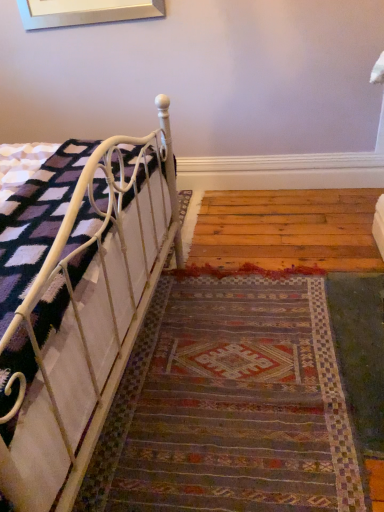
Question: From a real-world perspective, is white metal bed at left positioned above or below multicolored woven rug at center?

Choices:
 (A) below
 (B) above

Answer: (B)

Question: Is white metal bed at left to the left or to the right of multicolored woven rug at center in the image?

Choices:
 (A) left
 (B) right

Answer: (A)

Question: Is white metal bed at left wider or thinner than multicolored woven rug at center?

Choices:
 (A) thin
 (B) wide

Answer: (A)

Question: Considering the positions of multicolored woven rug at center and white metal bed at left in the image, is multicolored woven rug at center wider or thinner than white metal bed at left?

Choices:
 (A) wide
 (B) thin

Answer: (A)

Question: Is multicolored woven rug at center inside or outside of white metal bed at left?

Choices:
 (A) inside
 (B) outside

Answer: (B)

Question: In terms of height, does multicolored woven rug at center look taller or shorter compared to white metal bed at left?

Choices:
 (A) tall
 (B) short

Answer: (B)

Question: Would you say multicolored woven rug at center is to the left or to the right of white metal bed at left in the picture?

Choices:
 (A) right
 (B) left

Answer: (A)